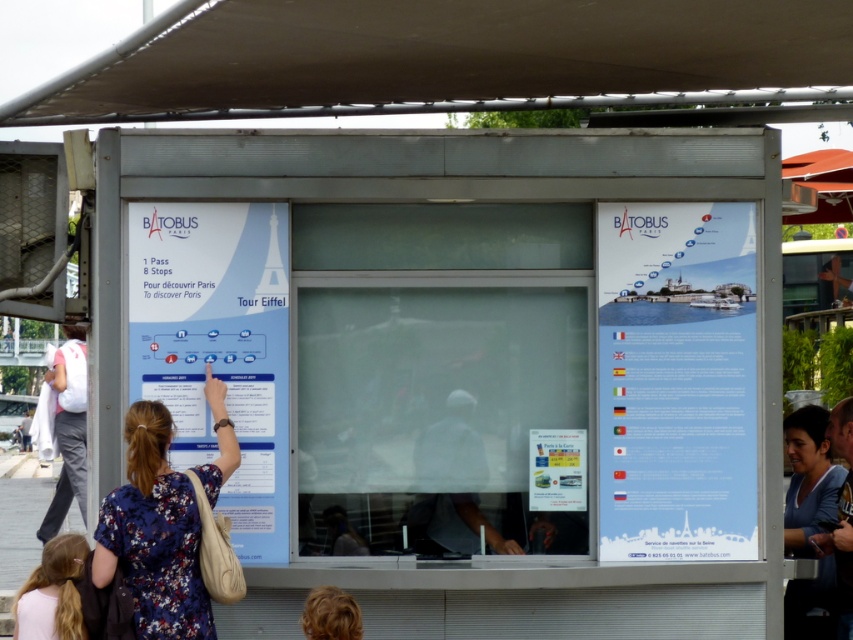
You are a tourist standing in front of the Batobus ticketing booth. You notice a blue paper poster at right and a blue floral dress at lower left. Which object is wider?

The blue paper poster at right is wider than the blue floral dress at lower left.

You are a tourist standing in front of the Batobus ticketing booth near the Seine River in Paris. You notice a gray fabric hat at center. Where exactly is the gray fabric hat located in relation to the booth?

Answer: The gray fabric hat at center is located at the center of the booth, specifically at the 2D coordinates point (451, 448).

You are a tourist standing in front of the Batobus ticketing booth. You notice the blue paper poster at right and the dark blue shirt at center. Which object is wider?

The blue paper poster at right is wider than the dark blue shirt at center because its width surpasses the dark blue shirt at center.